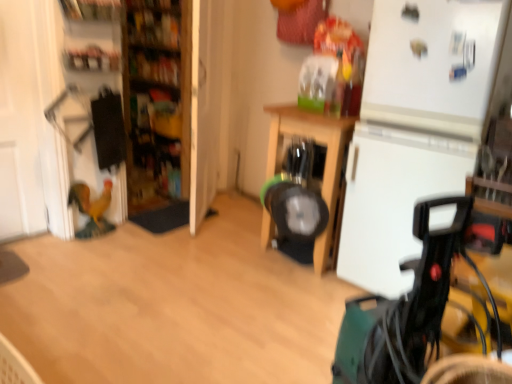
Question: Can you confirm if wooden bookshelf at upper left, marked as the 1th shelf in a top-to-bottom arrangement, is thinner than green plastic baby carriage at lower right?

Choices:
 (A) yes
 (B) no

Answer: (A)

Question: Is wooden bookshelf at upper left, positioned as the 2th shelf in bottom-to-top order, taller than green plastic baby carriage at lower right?

Choices:
 (A) yes
 (B) no

Answer: (B)

Question: Is wooden bookshelf at upper left, positioned as the 2th shelf in bottom-to-top order, at the left side of green plastic baby carriage at lower right?

Choices:
 (A) no
 (B) yes

Answer: (B)

Question: Is wooden bookshelf at upper left, positioned as the 2th shelf in bottom-to-top order, oriented away from green plastic baby carriage at lower right?

Choices:
 (A) no
 (B) yes

Answer: (A)

Question: Can you confirm if wooden bookshelf at upper left, marked as the 1th shelf in a top-to-bottom arrangement, is smaller than green plastic baby carriage at lower right?

Choices:
 (A) yes
 (B) no

Answer: (A)

Question: In terms of size, does green plastic baby carriage at lower right appear bigger or smaller than wooden shelves at left?

Choices:
 (A) big
 (B) small

Answer: (B)

Question: Considering their positions, is green plastic baby carriage at lower right located in front of or behind wooden shelves at left?

Choices:
 (A) behind
 (B) front

Answer: (B)

Question: From a real-world perspective, is green plastic baby carriage at lower right above or below wooden shelves at left?

Choices:
 (A) above
 (B) below

Answer: (B)

Question: Does point click(346, 309) appear closer or farther from the camera than point click(144, 14)?

Choices:
 (A) farther
 (B) closer

Answer: (B)

Question: In terms of width, does wooden table at center look wider or thinner when compared to green plastic baby carriage at lower right?

Choices:
 (A) wide
 (B) thin

Answer: (A)

Question: Relative to green plastic baby carriage at lower right, is wooden table at center in front or behind?

Choices:
 (A) front
 (B) behind

Answer: (B)

Question: Is wooden table at center bigger or smaller than green plastic baby carriage at lower right?

Choices:
 (A) small
 (B) big

Answer: (B)

Question: Is wooden table at center spatially inside green plastic baby carriage at lower right, or outside of it?

Choices:
 (A) inside
 (B) outside

Answer: (B)

Question: Relative to matte plastic shelf at upper left, arranged as the second shelf when viewed from the top, is wooden shelves at left in front or behind?

Choices:
 (A) behind
 (B) front

Answer: (A)

Question: In terms of width, does wooden shelves at left look wider or thinner when compared to matte plastic shelf at upper left, arranged as the second shelf when viewed from the top?

Choices:
 (A) wide
 (B) thin

Answer: (A)